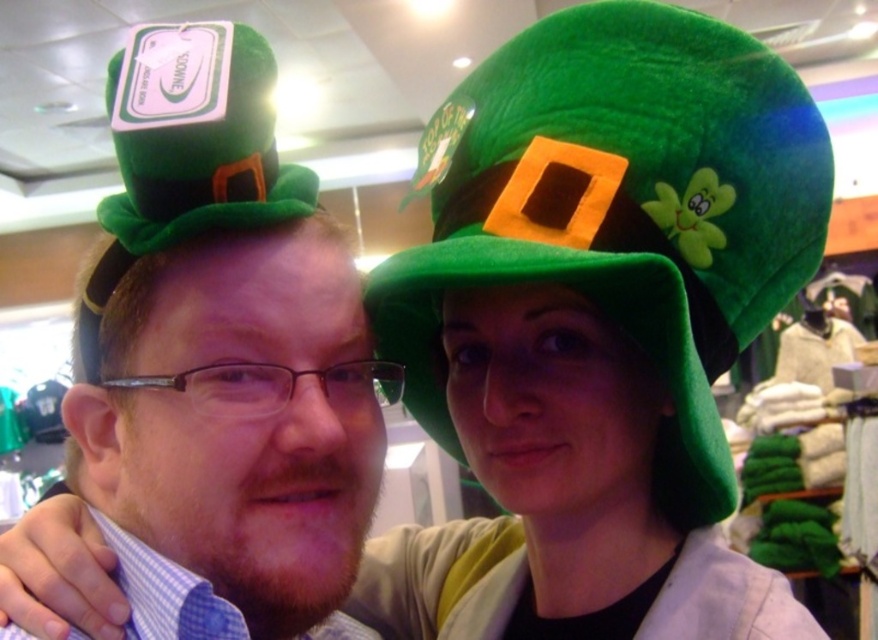
Question: Is velvety green hat at upper right above green plush hat at upper left?

Choices:
 (A) yes
 (B) no

Answer: (B)

Question: Does matte green hat at left appear under green plush hat at upper left?

Choices:
 (A) no
 (B) yes

Answer: (B)

Question: Which point is farther from the camera taking this photo?

Choices:
 (A) (296, 449)
 (B) (619, 86)

Answer: (B)

Question: Does velvety green hat at upper right appear on the left side of matte green hat at left?

Choices:
 (A) yes
 (B) no

Answer: (B)

Question: Which point is closer to the camera?

Choices:
 (A) green plush hat at upper left
 (B) velvety green hat at upper right

Answer: (A)

Question: Which object is positioned closest to the velvety green hat at upper right?

Choices:
 (A) green plush hat at upper left
 (B) matte green hat at left

Answer: (B)